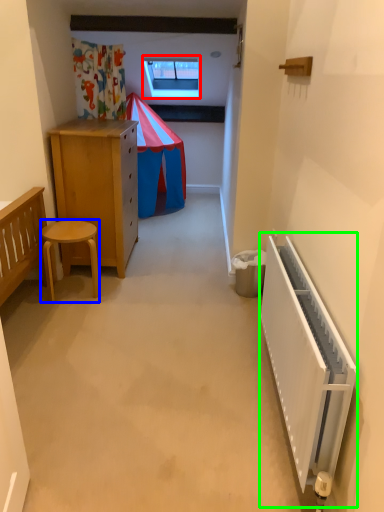
Question: Which object is positioned farthest from window (highlighted by a red box)? Select from stool (highlighted by a blue box) and radiator (highlighted by a green box).

Choices:
 (A) stool
 (B) radiator

Answer: (B)